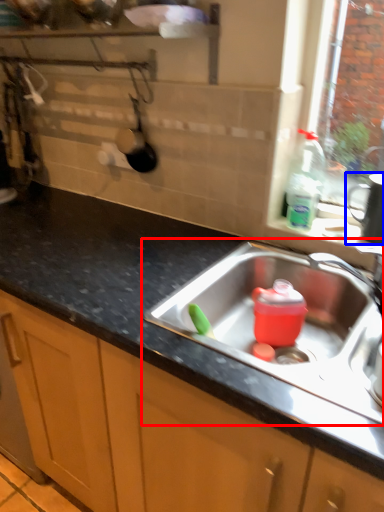
Question: Which object is closer to the camera taking this photo, sink (highlighted by a red box) or appliance (highlighted by a blue box)?

Choices:
 (A) sink
 (B) appliance

Answer: (A)